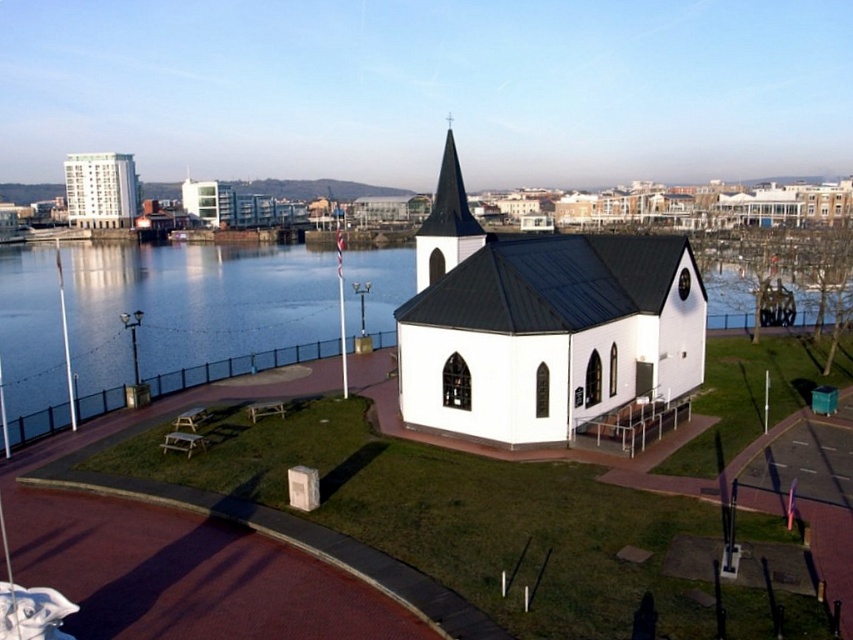
Question: In this image, where is white matte chapel at center located relative to blue water at center?

Choices:
 (A) below
 (B) above

Answer: (A)

Question: Which of the following is the farthest from the observer?

Choices:
 (A) blue water at center
 (B) white matte chapel at center
 (C) smooth white steeple at center

Answer: (C)

Question: Does blue water at center appear under smooth white steeple at center?

Choices:
 (A) no
 (B) yes

Answer: (A)

Question: Which point is closer to the camera?

Choices:
 (A) white matte chapel at center
 (B) smooth white steeple at center
 (C) white smooth building at upper left
 (D) blue water at center

Answer: (A)

Question: Is white matte chapel at center wider than smooth white steeple at center?

Choices:
 (A) no
 (B) yes

Answer: (B)

Question: Which point is closer to the camera?

Choices:
 (A) coord(97,214)
 (B) coord(440,260)

Answer: (B)